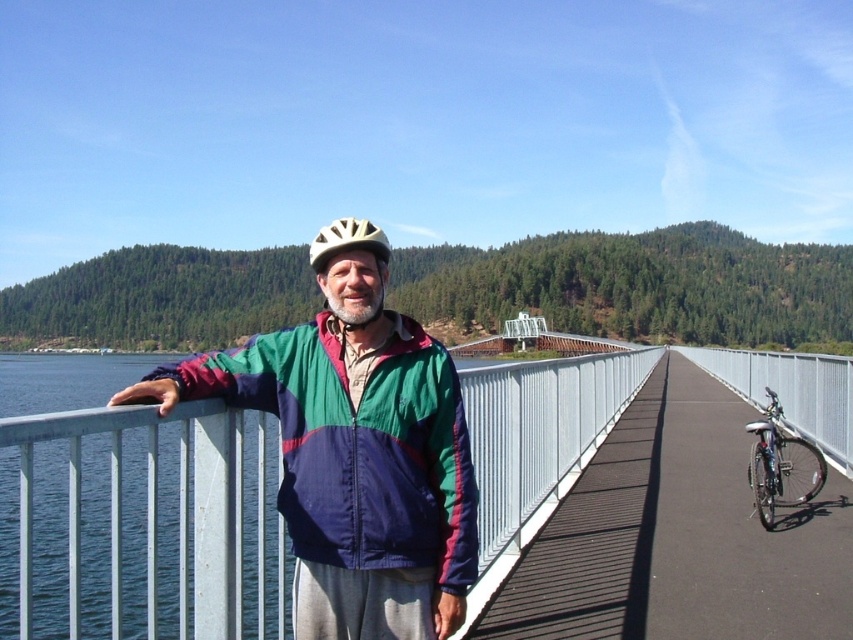
Does silver metallic bicycle at right have a greater height compared to matte yellow helmet at center?

No.

Is point (769, 410) positioned before point (343, 248)?

No.

Between point (751, 433) and point (380, 253), which one is positioned behind?

Point (751, 433)

Find the location of a particular element. This screenshot has height=640, width=853. silver metallic bicycle at right is located at coordinates (781, 465).

Is multicolored fabric jacket at center to the left of matte yellow helmet at center from the viewer's perspective?

In fact, multicolored fabric jacket at center is to the right of matte yellow helmet at center.

Who is more distant from viewer, (291, 481) or (350, 230)?

Point (350, 230)

This screenshot has height=640, width=853. In order to click on multicolored fabric jacket at center in this screenshot , I will do `click(358, 445)`.

Can you confirm if multicolored fabric jacket at center is bigger than silver metallic bicycle at right?

No, multicolored fabric jacket at center is not bigger than silver metallic bicycle at right.

Who is positioned more to the right, multicolored fabric jacket at center or silver metallic bicycle at right?

From the viewer's perspective, silver metallic bicycle at right appears more on the right side.

Where is `multicolored fabric jacket at center`? The width and height of the screenshot is (853, 640). multicolored fabric jacket at center is located at coordinates (358, 445).